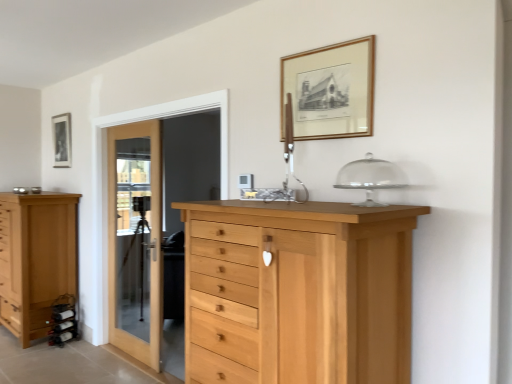
Question: Is matte black picture frame at upper left, which is the second picture frame from front to back, to the right of gold wooden picture frame at upper center, which appears as the 2th picture frame when viewed from the back, from the viewer's perspective?

Choices:
 (A) no
 (B) yes

Answer: (A)

Question: Is matte black picture frame at upper left, which is the second picture frame from front to back, positioned in front of gold wooden picture frame at upper center, which appears as the 2th picture frame when viewed from the back?

Choices:
 (A) no
 (B) yes

Answer: (A)

Question: Considering the relative sizes of matte black picture frame at upper left, which is the second picture frame from front to back, and gold wooden picture frame at upper center, the 1th picture frame from the front, in the image provided, is matte black picture frame at upper left, which is the second picture frame from front to back, smaller than gold wooden picture frame at upper center, the 1th picture frame from the front,?

Choices:
 (A) yes
 (B) no

Answer: (B)

Question: Is matte black picture frame at upper left, the second picture frame positioned from the right, directly adjacent to gold wooden picture frame at upper center, which appears as the 2th picture frame when viewed from the back?

Choices:
 (A) yes
 (B) no

Answer: (B)

Question: Considering the relative sizes of matte black picture frame at upper left, which is the second picture frame from front to back, and gold wooden picture frame at upper center, which appears as the 2th picture frame when viewed from the back, in the image provided, is matte black picture frame at upper left, which is the second picture frame from front to back, thinner than gold wooden picture frame at upper center, which appears as the 2th picture frame when viewed from the back,?

Choices:
 (A) no
 (B) yes

Answer: (A)

Question: From the image's perspective, is matte black picture frame at upper left, the 1th picture frame from the back, located beneath gold wooden picture frame at upper center, which appears as the 2th picture frame when viewed from the back?

Choices:
 (A) no
 (B) yes

Answer: (A)

Question: Is natural wood chest of drawers at center, the 2th chest of drawers from the back, facing towards matte black picture frame at upper left, the second picture frame positioned from the right?

Choices:
 (A) yes
 (B) no

Answer: (B)

Question: Is natural wood chest of drawers at center, which is counted as the first chest of drawers, starting from the right, to the left of matte black picture frame at upper left, the 1th picture frame from the back, from the viewer's perspective?

Choices:
 (A) no
 (B) yes

Answer: (A)

Question: Is the position of natural wood chest of drawers at center, which is counted as the first chest of drawers, starting from the right, less distant than that of matte black picture frame at upper left, the 1th picture frame from the back?

Choices:
 (A) no
 (B) yes

Answer: (B)

Question: From a real-world perspective, is natural wood chest of drawers at center, marked as the 1th chest of drawers in a front-to-back arrangement, located beneath matte black picture frame at upper left, which is the second picture frame from front to back?

Choices:
 (A) yes
 (B) no

Answer: (A)

Question: From the image's perspective, is natural wood chest of drawers at center, which is counted as the first chest of drawers, starting from the right, over matte black picture frame at upper left, the first picture frame in the left-to-right sequence?

Choices:
 (A) yes
 (B) no

Answer: (B)

Question: Is natural wood chest of drawers at center, the second chest of drawers viewed from the left, shorter than matte black picture frame at upper left, the second picture frame positioned from the right?

Choices:
 (A) yes
 (B) no

Answer: (B)

Question: Is natural wood chest of drawers at center, which is counted as the first chest of drawers, starting from the right, at the back of light brown wooden chest of drawers at left, acting as the second chest of drawers starting from the right?

Choices:
 (A) no
 (B) yes

Answer: (A)